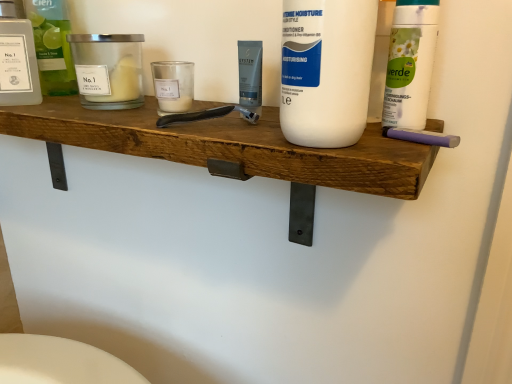
Question: Is point pos(73,71) closer or farther from the camera than point pos(384,182)?

Choices:
 (A) closer
 (B) farther

Answer: (B)

Question: In terms of width, does translucent glass bottle at upper left, which is counted as the 3th cleaning product, starting from the right, look wider or thinner when compared to wooden shelf at center?

Choices:
 (A) wide
 (B) thin

Answer: (B)

Question: Which of these objects is positioned closest to the wooden shelf at center?

Choices:
 (A) purple rubber eraser at right, the 1th personal care positioned from the right
 (B) matte glass candle at left, the second personal care from the right
 (C) translucent glass bottle at upper left, placed as the third cleaning product when sorted from front to back
 (D) white matte bottle at upper right, the third cleaning product in the left-to-right sequence
 (E) white matte bottle at center, marked as the 3th cleaning product in a back-to-front arrangement

Answer: (E)

Question: Which is nearer to the transparent plastic bottle at left, the 1th personal care when ordered from left to right?

Choices:
 (A) purple rubber eraser at right, marked as the 3th personal care in a left-to-right arrangement
 (B) white matte bottle at center, marked as the 3th cleaning product in a back-to-front arrangement
 (C) white matte bottle at upper right, the second cleaning product viewed from the back
 (D) wooden shelf at center
 (E) matte glass candle at left, which is the 2th personal care from left to right

Answer: (E)